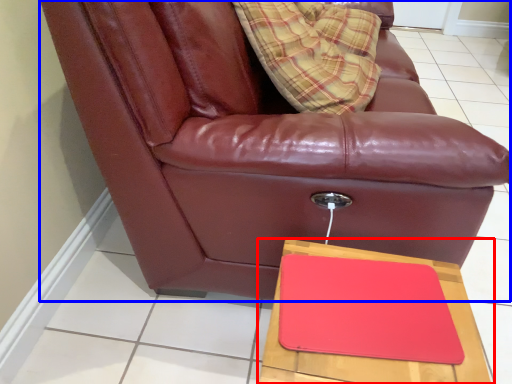
Question: Which object is further to the camera taking this photo, table (highlighted by a red box) or chair (highlighted by a blue box)?

Choices:
 (A) table
 (B) chair

Answer: (B)